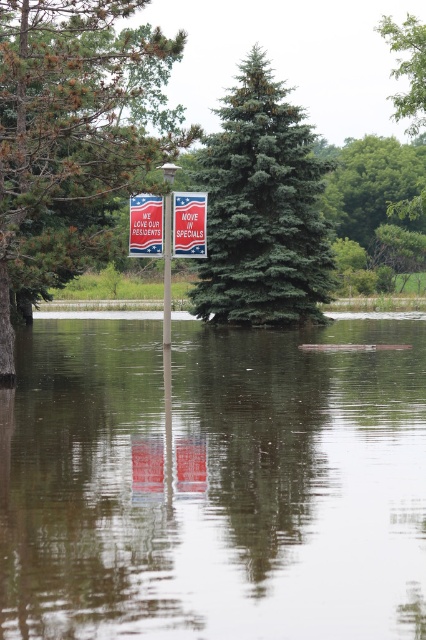
Does point (195, 193) lie behind point (160, 224)?

No, it is in front of (160, 224).

Which is behind, point (184, 236) or point (157, 205)?

The point (184, 236) is more distant.

Between point (187, 195) and point (147, 250), which one is positioned in front?

Positioned in front is point (147, 250).

Locate an element on the screen. This screenshot has height=640, width=426. red plastic sign at center is located at coordinates (189, 224).

Can you confirm if clear water at center is bigger than red plastic sign at center?

Yes, clear water at center is bigger than red plastic sign at center.

Is clear water at center to the left of red plastic sign at center from the viewer's perspective?

Incorrect, clear water at center is not on the left side of red plastic sign at center.

Where is `clear water at center`? clear water at center is located at coordinates (213, 483).

Identify the location of clear water at center. (213, 483).

Who is positioned more to the right, green textured pine tree at center or metallic pole at center?

metallic pole at center is more to the right.

Who is positioned more to the left, green textured pine tree at center or metallic pole at center?

Positioned to the left is green textured pine tree at center.

Image resolution: width=426 pixels, height=640 pixels. I want to click on green textured pine tree at center, so click(x=74, y=134).